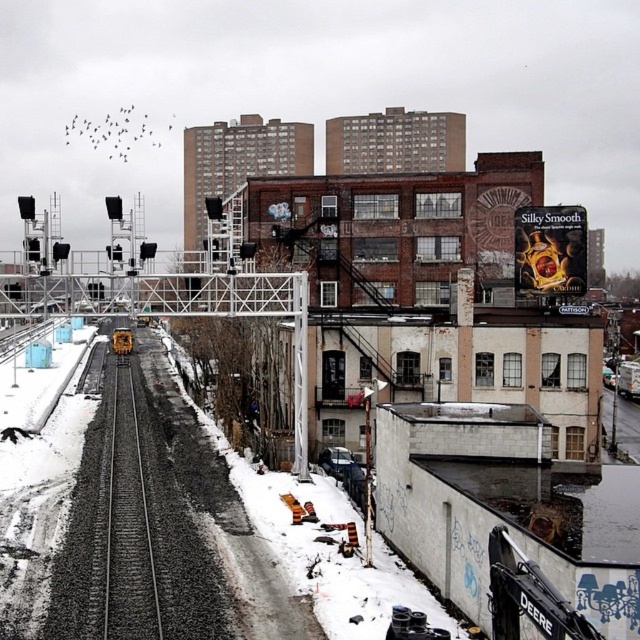
Question: Which object appears farthest from the camera in this image?

Choices:
 (A) yellow metallic train at center
 (B) smooth asphalt train track at center

Answer: (A)

Question: Does smooth asphalt train track at center come in front of yellow metallic train at center?

Choices:
 (A) no
 (B) yes

Answer: (B)

Question: Which object appears farthest from the camera in this image?

Choices:
 (A) smooth asphalt train track at center
 (B) yellow metallic train at center

Answer: (B)

Question: In this image, where is smooth asphalt train track at center located relative to yellow metallic train at center?

Choices:
 (A) left
 (B) right

Answer: (B)

Question: Can you confirm if smooth asphalt train track at center is positioned to the left of yellow metallic train at center?

Choices:
 (A) no
 (B) yes

Answer: (A)